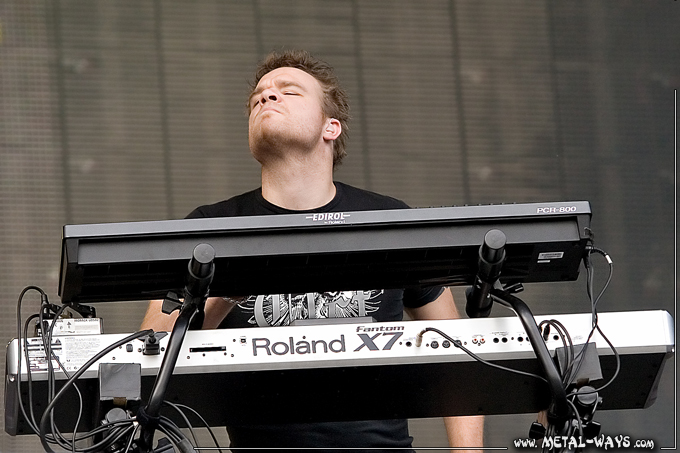
Identify the location of keyboard holder bars. (166, 376), (534, 337).